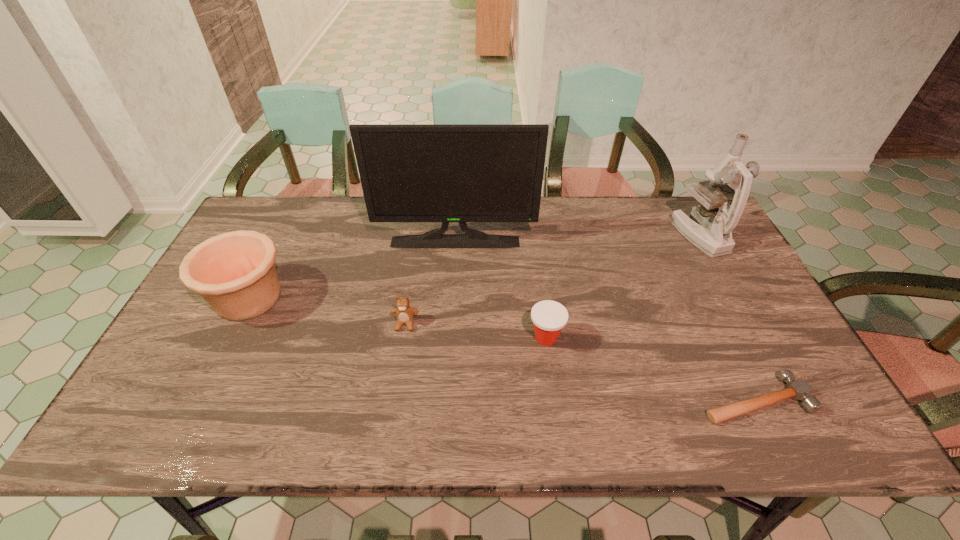
Where is `monitor`? The height and width of the screenshot is (540, 960). monitor is located at coordinates (445, 173).

You are a GUI agent. You are given a task and a screenshot of the screen. Output one action in this format:
    pyautogui.click(x=<x>, y=<y>)
    Task: Click on the microscope
    
    Given the screenshot: What is the action you would take?
    pyautogui.click(x=712, y=233)

At what (x,y) coordinates should I click in order to perform the action: click on the leftmost object. Please return your answer as a coordinate pair (x, y). Looking at the image, I should click on (235, 273).

You are a GUI agent. You are given a task and a screenshot of the screen. Output one action in this format:
    pyautogui.click(x=<x>, y=<y>)
    Task: Click on the third tallest object
    The image size is (960, 540).
    Given the screenshot: What is the action you would take?
    pyautogui.click(x=235, y=273)

I want to click on Dixie cup, so click(x=549, y=317).

Find the location of a particular element. The image size is (960, 540). teddy bear is located at coordinates (404, 313).

You are a GUI agent. You are given a task and a screenshot of the screen. Output one action in this format:
    pyautogui.click(x=<x>, y=<y>)
    Task: Click on the nearest object
    This screenshot has height=540, width=960.
    Given the screenshot: What is the action you would take?
    pyautogui.click(x=797, y=389)

The width and height of the screenshot is (960, 540). What are the coordinates of `hammer` in the screenshot? It's located at (797, 389).

Image resolution: width=960 pixels, height=540 pixels. What are the coordinates of `vacant space situated on the front-facing side of the monitor` in the screenshot? It's located at (451, 298).

In order to click on free space located 0.200m on the front of the microscope in this screenshot , I will do `click(738, 307)`.